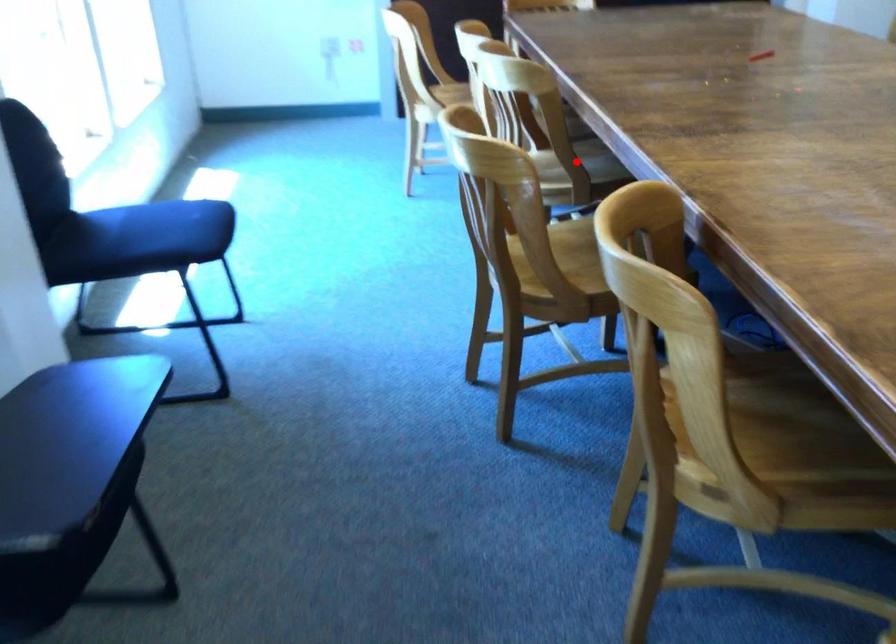
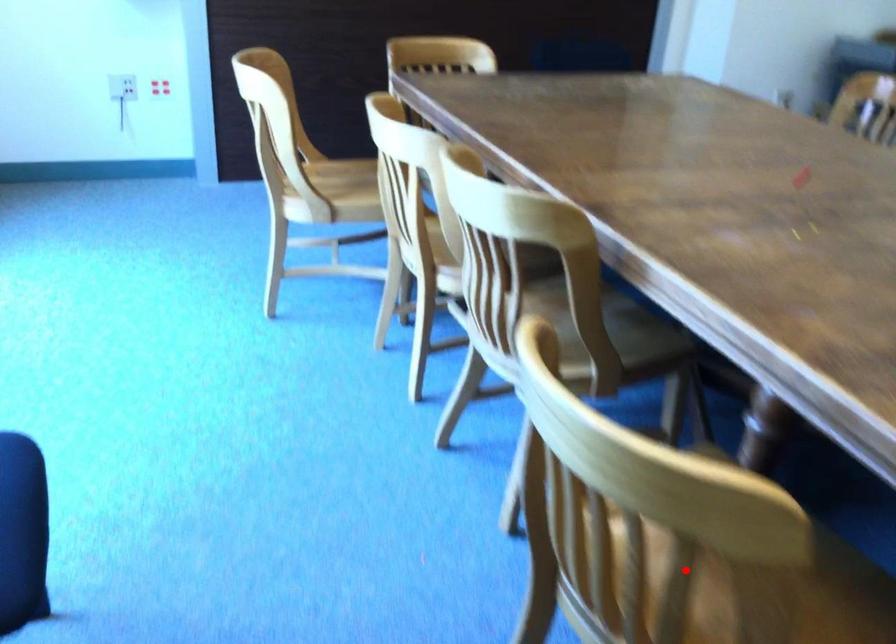
I am providing you with two images of the same scene from different viewpoints. A red point is marked on the first image and another point is marked on the second image. Are the points marked in image1 and image2 representing the same 3D position?

No